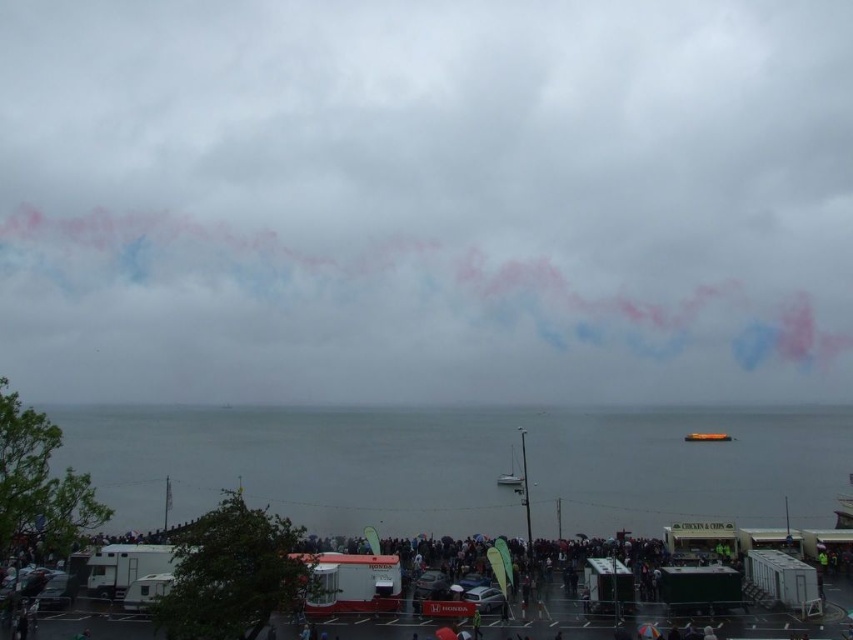
You are a photographer wanting to capture the pink smoke at upper center and the gray water at lower center in the same frame. Which object will appear larger in your photo?

The pink smoke at upper center is taller than the gray water at lower center, so it will appear larger in the photo.

You are a photographer trying to capture a photo of the pink smoke at upper center and the gray water at lower center in the same frame. Given that your camera has a maximum focus range of 100 meters, will you be able to capture both objects clearly in one shot?

The distance between the pink smoke at upper center and gray water at lower center is 129.35 meters, which exceeds the camera maximum focus range of 100 meters. Therefore, you won not be able to capture both objects clearly in one shot.